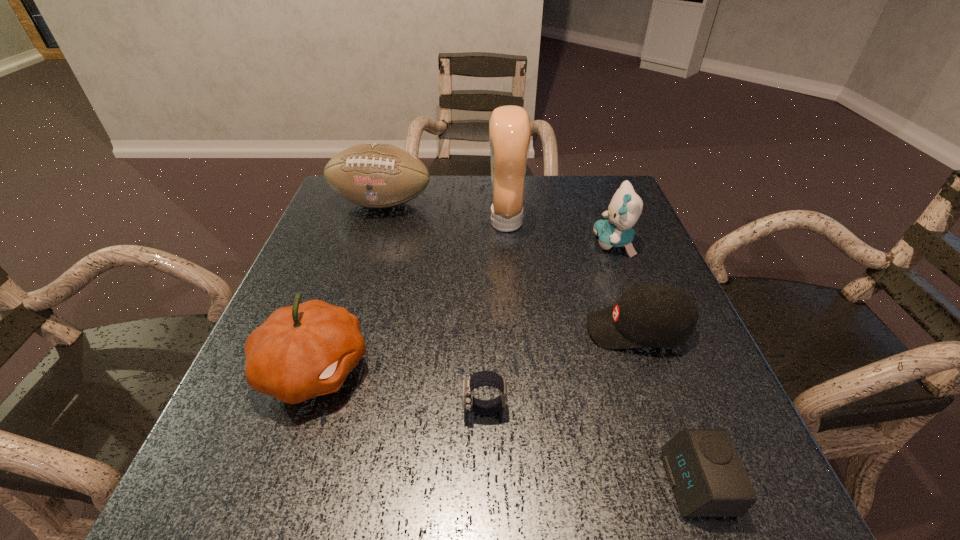
Find the location of a particular element. free space located on the label of the condiment is located at coordinates (415, 222).

At what (x,y) coordinates should I click in order to perform the action: click on vacant position located on the laces of the football (American). Please return your answer as a coordinate pair (x, y). Image resolution: width=960 pixels, height=540 pixels. Looking at the image, I should click on (364, 259).

Find the location of a particular element. This screenshot has height=540, width=960. vacant space located on the face of the kitten is located at coordinates (504, 243).

The width and height of the screenshot is (960, 540). In order to click on vacant area situated 0.370m on the face of the kitten in this screenshot , I will do `click(444, 243)`.

Image resolution: width=960 pixels, height=540 pixels. Find the location of `vacant space located 0.230m on the face of the kitten`. vacant space located 0.230m on the face of the kitten is located at coordinates (500, 243).

Identify the location of free space located on the front face of the pumpkin. (482, 369).

Identify the location of vacant space located 0.180m with a logo on the front of the baseball cap. This screenshot has height=540, width=960. (494, 329).

You are a GUI agent. You are given a task and a screenshot of the screen. Output one action in this format:
    pyautogui.click(x=<x>, y=<y>)
    Task: Click on the blank area located 0.380m with a logo on the front of the baseball cap
    This screenshot has height=540, width=960.
    Given the screenshot: What is the action you would take?
    pyautogui.click(x=394, y=329)

In order to click on free space located with a logo on the front of the baseball cap in this screenshot , I will do `click(449, 329)`.

Where is `free point located on the face of the watch`? The width and height of the screenshot is (960, 540). free point located on the face of the watch is located at coordinates [289, 409].